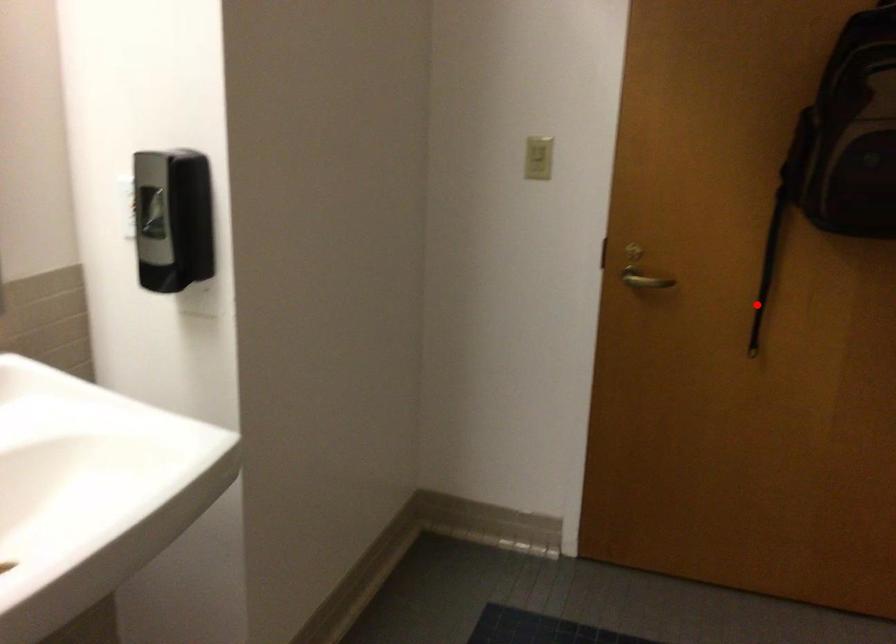
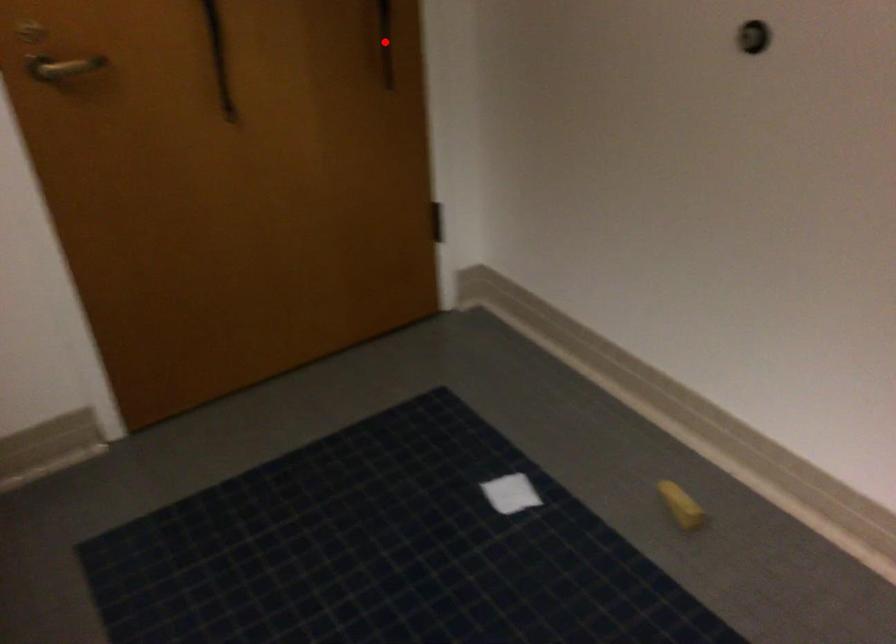
I am providing you with two images of the same scene from different viewpoints. A red point is marked on the first image and another point is marked on the second image. Does the point marked in image1 correspond to the same location as the one in image2?

No